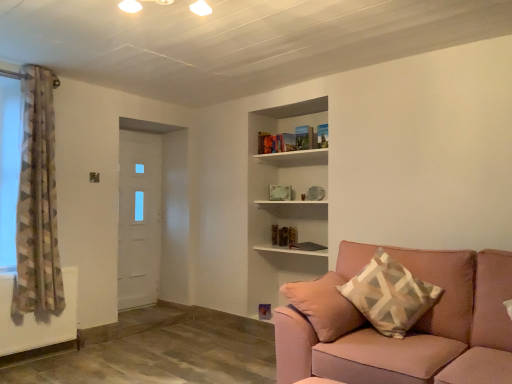
Where is `white matte door at left`? The height and width of the screenshot is (384, 512). white matte door at left is located at coordinates (139, 219).

This screenshot has height=384, width=512. Find the location of `beige geometric-patterned pillow at right`. beige geometric-patterned pillow at right is located at coordinates pos(389,295).

The width and height of the screenshot is (512, 384). I want to click on door on the left of white wooden shelf at upper center, so click(x=139, y=219).

Can you confirm if white matte door at left is wider than white wooden shelf at upper center?

No, white matte door at left is not wider than white wooden shelf at upper center.

Is white matte door at left taller or shorter than white wooden shelf at upper center?

white matte door at left is taller than white wooden shelf at upper center.

Can you see white matte door at left touching white wooden shelf at upper center?

white matte door at left and white wooden shelf at upper center are not in contact.

Considering the relative sizes of beige geometric-patterned pillow at right and geometric-patterned fabric curtain at left in the image provided, is beige geometric-patterned pillow at right shorter than geometric-patterned fabric curtain at left?

Indeed, beige geometric-patterned pillow at right has a lesser height compared to geometric-patterned fabric curtain at left.

I want to click on pillow on the right of geometric-patterned fabric curtain at left, so click(x=389, y=295).

In the scene shown: Does beige geometric-patterned pillow at right have a larger size compared to geometric-patterned fabric curtain at left?

Incorrect, beige geometric-patterned pillow at right is not larger than geometric-patterned fabric curtain at left.

Is the depth of beige geometric-patterned pillow at right greater than that of geometric-patterned fabric curtain at left?

No, it is not.

Based on their sizes in the image, would you say geometric-patterned fabric curtain at left is bigger or smaller than white wooden shelf at upper center?

In the image, geometric-patterned fabric curtain at left appears to be larger than white wooden shelf at upper center.

From the image's perspective, is geometric-patterned fabric curtain at left on top of white wooden shelf at upper center?

Actually, geometric-patterned fabric curtain at left appears below white wooden shelf at upper center in the image.

From a real-world perspective, is geometric-patterned fabric curtain at left on top of white wooden shelf at upper center?

Actually, geometric-patterned fabric curtain at left is physically below white wooden shelf at upper center in the real world.

Is geometric-patterned fabric curtain at left not close to white wooden shelf at upper center?

Yes, geometric-patterned fabric curtain at left and white wooden shelf at upper center are quite far apart.

Is white wooden shelf at upper center facing towards white matte door at left?

No, white wooden shelf at upper center is not oriented towards white matte door at left.

Which object is closer to the camera taking this photo, white wooden shelf at upper center or white matte door at left?

white wooden shelf at upper center.

Is white wooden shelf at upper center taller than white matte door at left?

No.

Is beige geometric-patterned pillow at right facing away from pink fabric couch at lower right?

Absolutely, beige geometric-patterned pillow at right is directed away from pink fabric couch at lower right.

The width and height of the screenshot is (512, 384). Identify the location of studio couch that is under the beige geometric-patterned pillow at right (from a real-world perspective). (411, 328).

Is pink fabric couch at lower right a part of beige geometric-patterned pillow at right?

No, pink fabric couch at lower right is not surrounded by beige geometric-patterned pillow at right.

Consider the image. Does geometric-patterned fabric curtain at left lie behind pink fabric couch at lower right?

Yes.

Does point (51, 188) lie behind point (360, 248)?

That is True.

Is geometric-patterned fabric curtain at left facing towards pink fabric couch at lower right?

No, geometric-patterned fabric curtain at left is not oriented towards pink fabric couch at lower right.

Is beige geometric-patterned pillow at right at the left side of white wooden shelf at upper center?

No.

Does beige geometric-patterned pillow at right have a lesser height compared to white wooden shelf at upper center?

Incorrect, the height of beige geometric-patterned pillow at right does not fall short of that of white wooden shelf at upper center.

From a real-world perspective, is beige geometric-patterned pillow at right on white wooden shelf at upper center?

Incorrect, from a real-world perspective, beige geometric-patterned pillow at right is lower than white wooden shelf at upper center.

This screenshot has width=512, height=384. Identify the location of door behind the white wooden shelf at upper center. [x=139, y=219].

Locate an element on the screen. Image resolution: width=512 pixels, height=384 pixels. pillow below the geometric-patterned fabric curtain at left (from a real-world perspective) is located at coordinates (x=389, y=295).

Considering their positions, is pink fabric couch at lower right positioned closer to white wooden shelf at upper center than beige geometric-patterned pillow at right?

beige geometric-patterned pillow at right.

Considering their positions, is beige geometric-patterned pillow at right positioned closer to white wooden shelf at upper center than geometric-patterned fabric curtain at left?

Among the two, beige geometric-patterned pillow at right is located nearer to white wooden shelf at upper center.

Estimate the real-world distances between objects in this image. Which object is further from beige geometric-patterned pillow at right, white wooden shelf at upper center or white matte door at left?

white matte door at left lies further to beige geometric-patterned pillow at right than the other object.

When comparing their distances from pink fabric couch at lower right, does beige geometric-patterned pillow at right or geometric-patterned fabric curtain at left seem closer?

beige geometric-patterned pillow at right.

From the image, which object appears to be nearer to white wooden shelf at upper center, pink fabric couch at lower right or white matte door at left?

Among the two, white matte door at left is located nearer to white wooden shelf at upper center.

Which object lies further to the anchor point beige geometric-patterned pillow at right, white wooden shelf at upper center or geometric-patterned fabric curtain at left?

The object further to beige geometric-patterned pillow at right is geometric-patterned fabric curtain at left.

Looking at the image, which one is located closer to pink fabric couch at lower right, white wooden shelf at upper center or beige geometric-patterned pillow at right?

The object closer to pink fabric couch at lower right is beige geometric-patterned pillow at right.

Estimate the real-world distances between objects in this image. Which object is further from pink fabric couch at lower right, white wooden shelf at upper center or geometric-patterned fabric curtain at left?

geometric-patterned fabric curtain at left is further to pink fabric couch at lower right.

Where is `shelf located between geometric-patterned fabric curtain at left and beige geometric-patterned pillow at right in the left-right direction`? The image size is (512, 384). shelf located between geometric-patterned fabric curtain at left and beige geometric-patterned pillow at right in the left-right direction is located at coordinates (294, 158).

Where is `door between geometric-patterned fabric curtain at left and beige geometric-patterned pillow at right`? door between geometric-patterned fabric curtain at left and beige geometric-patterned pillow at right is located at coordinates (139, 219).

This screenshot has width=512, height=384. Find the location of `pillow between pink fabric couch at lower right and white matte door at left from front to back`. pillow between pink fabric couch at lower right and white matte door at left from front to back is located at coordinates (389, 295).

The image size is (512, 384). In order to click on shelf between pink fabric couch at lower right and white matte door at left along the z-axis in this screenshot , I will do `click(294, 158)`.